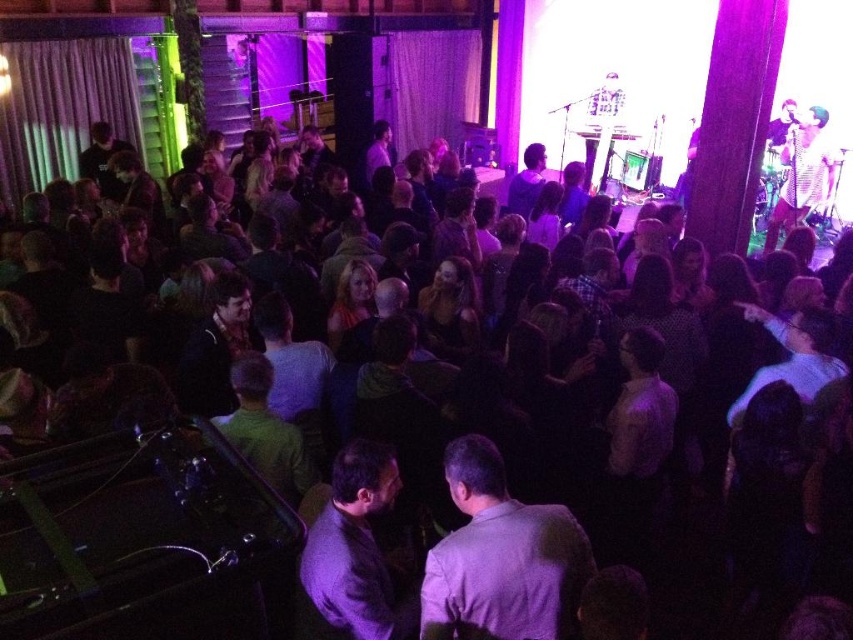
You are at the event and want to see the stage better. There are two people in front of you, one wearing a light purple shirt at center and another in a dark gray suit at center. Which person is blocking your view more?

The light purple shirt at center is positioned over dark gray suit at center, meaning it is closer to you. Therefore, the light purple shirt at center is blocking your view more than the dark gray suit at center.

You are at the lively indoor event and want to move from your current position to the stage. There are two points marked in the image. Which point should you move towards if you want to reach the stage faster? Please choose between point (431, 637) and point (358, 572).

Point (431, 637) is in front of point (358, 572). Since it is closer to the stage, you should move towards point (431, 637) to reach the stage faster.

You are at the event and want to take a photo of both the light purple shirt at center and the dark gray suit at center. To ensure both are in frame, should you adjust your camera to focus more to the left or the right?

The light purple shirt at center is positioned on the right side of dark gray suit at center, so you should focus more to the right to include both in the frame.